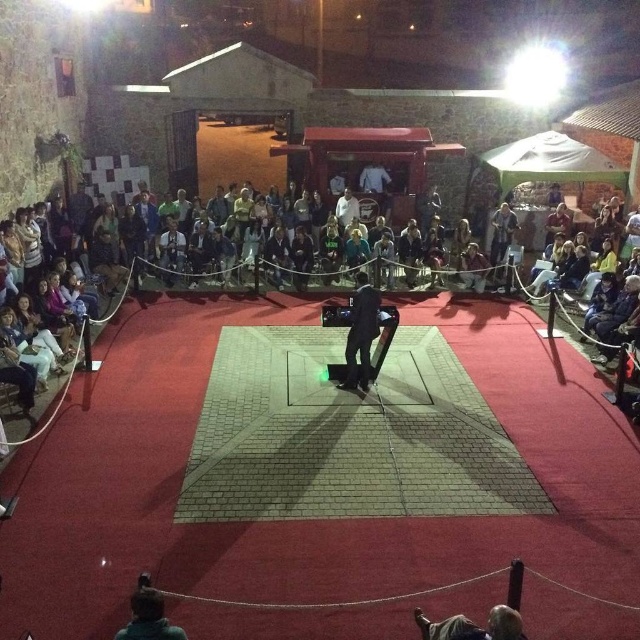
Question: Which of the following is the farthest from the observer?

Choices:
 (A) light brown leather jacket at center
 (B) dark gray fabric pants at center

Answer: (A)

Question: Is dark gray fabric pants at center to the right of white cotton shirt at center from the viewer's perspective?

Choices:
 (A) no
 (B) yes

Answer: (B)

Question: Can you confirm if light brown leather jacket at center is positioned below white cotton shirt at center?

Choices:
 (A) yes
 (B) no

Answer: (A)

Question: Which object is closer to the camera taking this photo?

Choices:
 (A) white cotton shirt at center
 (B) light brown leather jacket at center
 (C) dark gray fabric pants at center

Answer: (C)

Question: Can you confirm if dark gray fabric pants at center is positioned below light brown leather jacket at center?

Choices:
 (A) yes
 (B) no

Answer: (A)

Question: Which of the following is the closest to the observer?

Choices:
 (A) (353, 330)
 (B) (342, 205)
 (C) (180, 248)

Answer: (A)